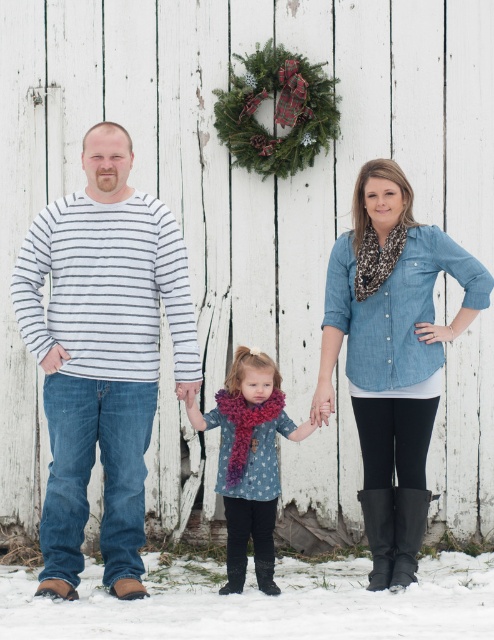
Between point (32, 630) and point (246, 138), which one is positioned in front?

Point (32, 630) is more forward.

Which is in front, point (80, 614) or point (247, 104)?

Positioned in front is point (80, 614).

Identify the location of white fluffy snow at lower center. [x=260, y=604].

Is chambray shirt at center to the left of white fluffy snow at lower center from the viewer's perspective?

In fact, chambray shirt at center is to the right of white fluffy snow at lower center.

Between chambray shirt at center and white fluffy snow at lower center, which one appears on the right side from the viewer's perspective?

chambray shirt at center is more to the right.

Where is `chambray shirt at center`? This screenshot has height=640, width=494. chambray shirt at center is located at coordinates (392, 355).

Who is taller, striped cotton shirt at center or chambray shirt at center?

striped cotton shirt at center

Identify the location of striped cotton shirt at center. The height and width of the screenshot is (640, 494). (101, 353).

This screenshot has height=640, width=494. Find the location of `striped cotton shirt at center`. striped cotton shirt at center is located at coordinates (101, 353).